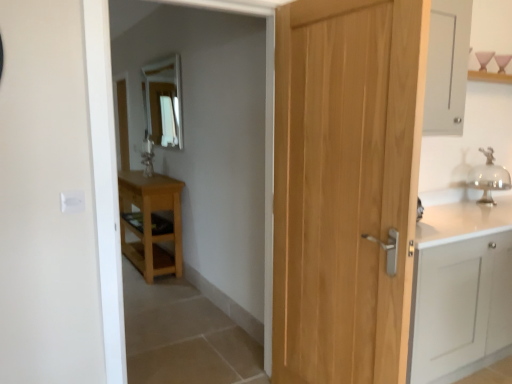
Question: Looking at their shapes, would you say light brown wood door at center is wider or thinner than clear glass mirror at upper center?

Choices:
 (A) thin
 (B) wide

Answer: (B)

Question: Considering the positions of light brown wood door at center and clear glass mirror at upper center in the image, is light brown wood door at center taller or shorter than clear glass mirror at upper center?

Choices:
 (A) short
 (B) tall

Answer: (B)

Question: Which object is positioned closest to the light brown wood door at center?

Choices:
 (A) clear glass mirror at upper center
 (B) clear glass bell at right
 (C) light wood table at left

Answer: (B)

Question: Which object is positioned farthest from the light wood table at left?

Choices:
 (A) clear glass bell at right
 (B) light brown wood door at center
 (C) clear glass mirror at upper center

Answer: (A)